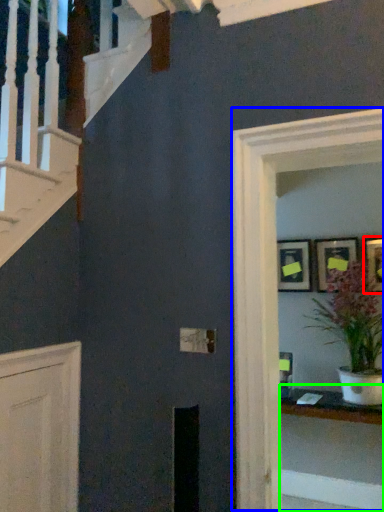
Question: Estimate the real-world distances between objects in this image. Which object is closer to picture frame (highlighted by a red box), glass door (highlighted by a blue box) or table (highlighted by a green box)?

Choices:
 (A) glass door
 (B) table

Answer: (B)